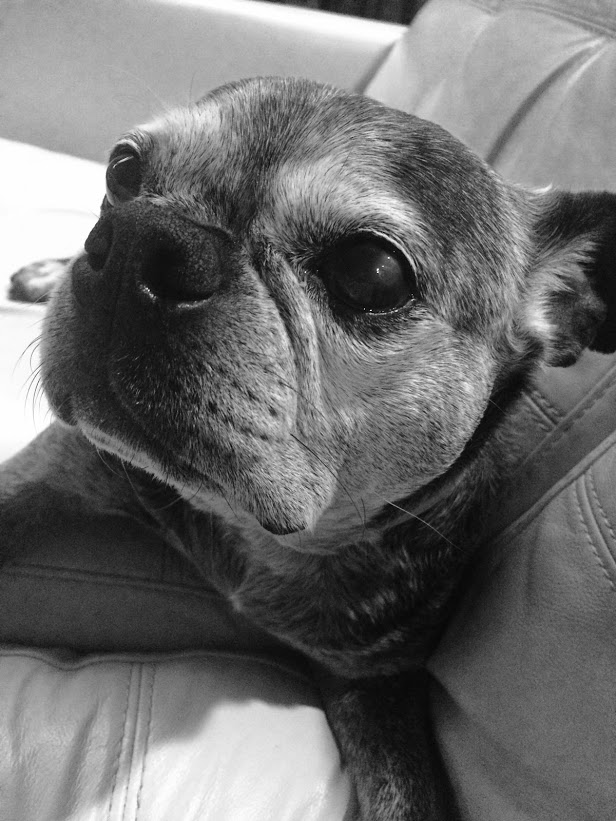
Find the location of a particular element. The height and width of the screenshot is (821, 616). couch is located at coordinates (517, 649), (509, 131).